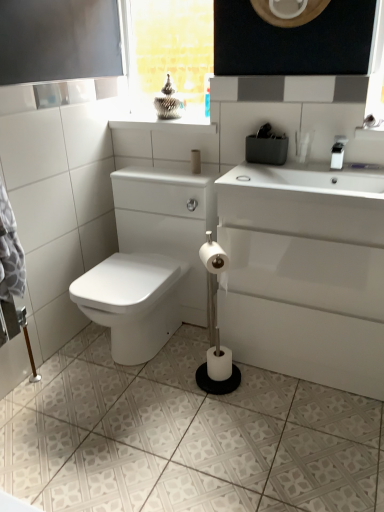
Image resolution: width=384 pixels, height=512 pixels. Identify the location of vacant space behind white matte toilet paper at center, which is the second toilet paper from back to front. (193, 351).